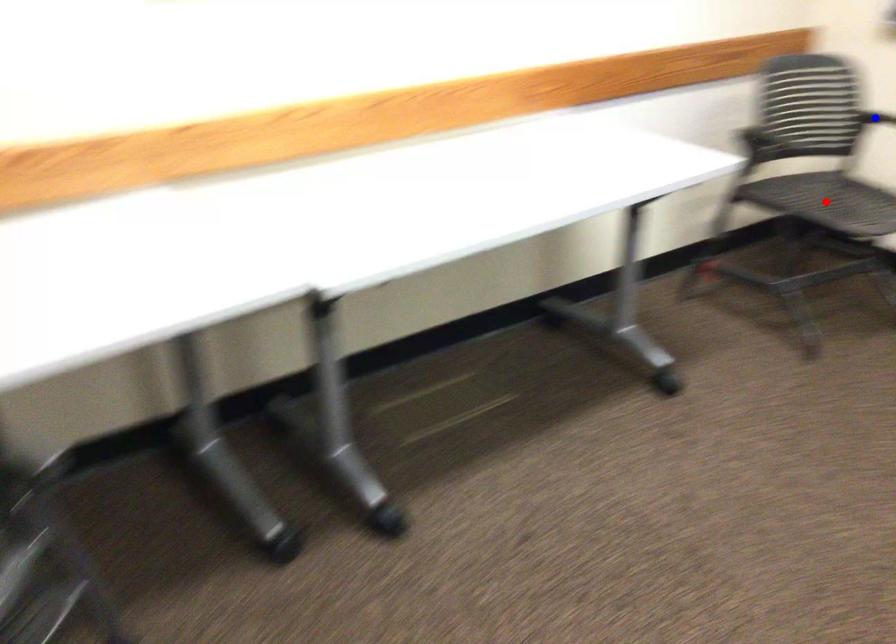
Question: Which of the two points in the image is closer to the camera?

Choices:
 (A) Blue point is closer.
 (B) Red point is closer.

Answer: (B)